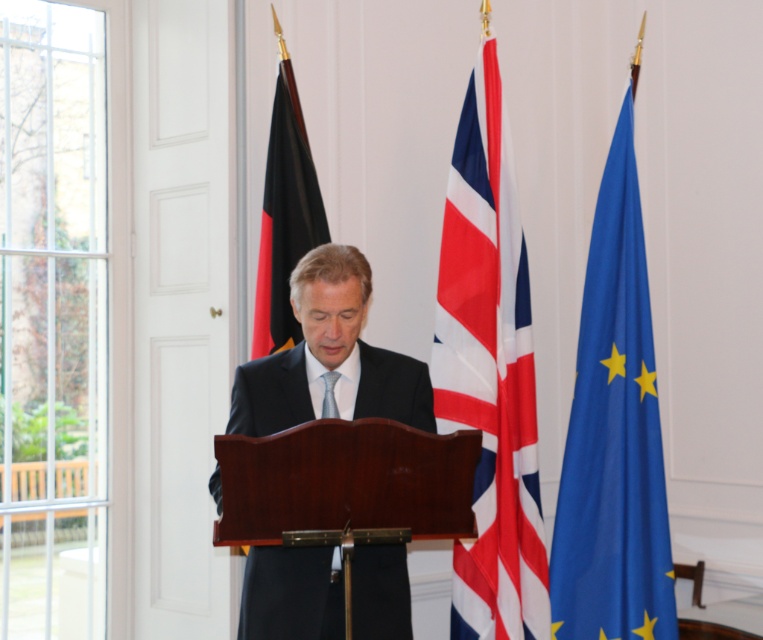
Question: Is red-white-blue fabric flag at center wider than black fabric flag at left?

Choices:
 (A) no
 (B) yes

Answer: (B)

Question: Based on their relative distances, which object is nearer to the red-white-blue fabric flag at center?

Choices:
 (A) matte black suit at center
 (B) blue fabric flag at right
 (C) black fabric flag at left

Answer: (B)

Question: Does blue fabric flag at right have a smaller size compared to matte black suit at center?

Choices:
 (A) no
 (B) yes

Answer: (A)

Question: Which of the following is the farthest from the observer?

Choices:
 (A) (452, 541)
 (B) (327, 401)
 (C) (604, 516)

Answer: (C)

Question: Which object is farther from the camera taking this photo?

Choices:
 (A) red-white-blue fabric flag at center
 (B) silky blue tie at center
 (C) blue fabric flag at right

Answer: (C)

Question: Is red-white-blue fabric flag at center above blue fabric flag at right?

Choices:
 (A) no
 (B) yes

Answer: (B)